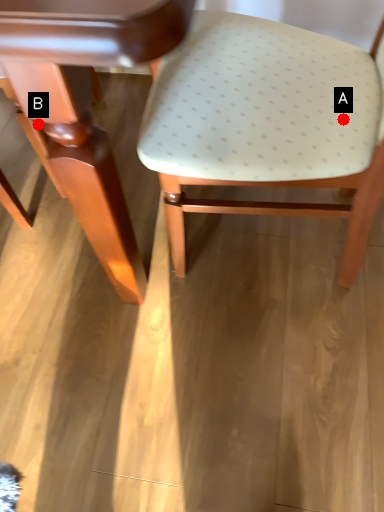
Question: Two points are circled on the image, labeled by A and B beside each circle. Which of the following is the farthest from the observer?

Choices:
 (A) A is further
 (B) B is further

Answer: (B)